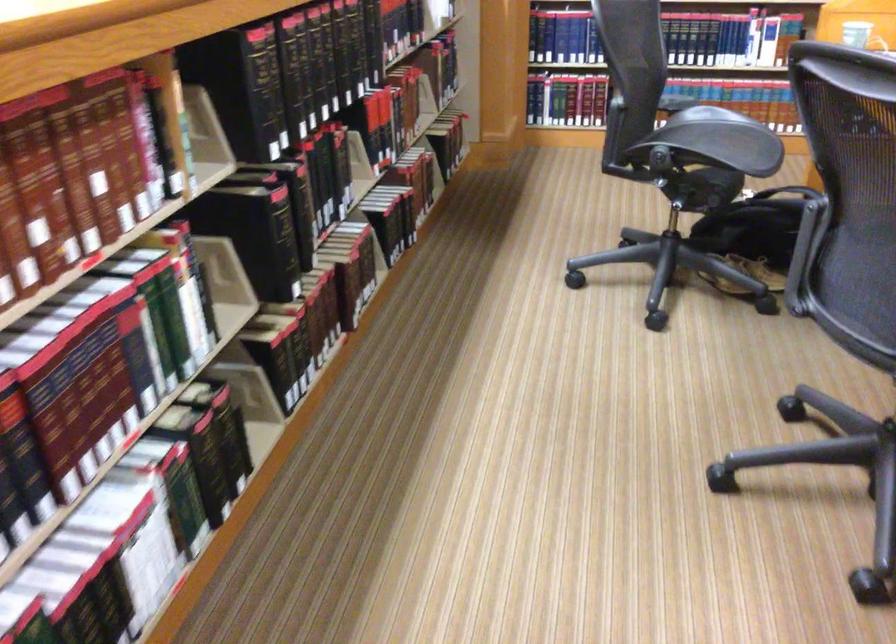
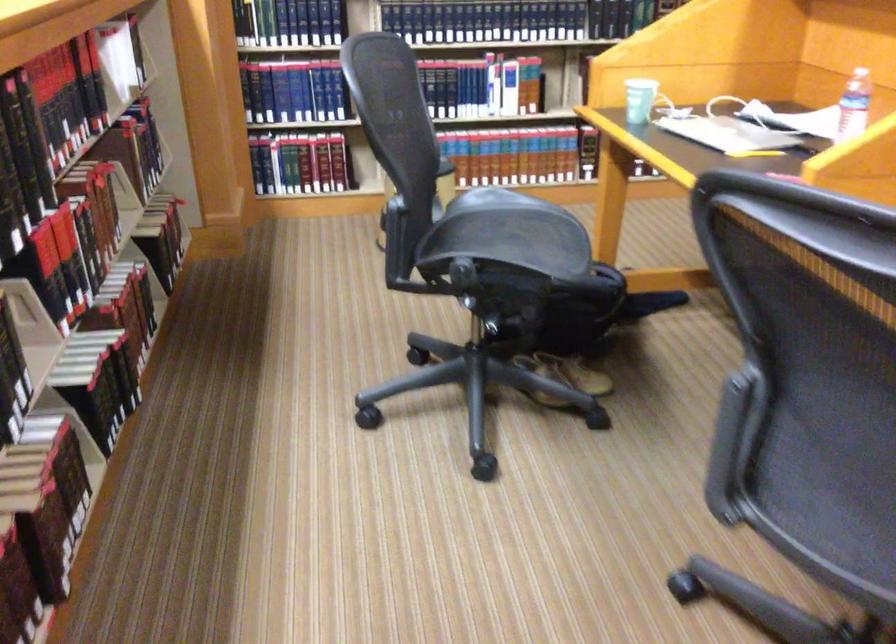
Question: The camera is either moving clockwise (left) or counter-clockwise (right) around the object. The first image is from the beginning of the video and the second image is from the end. Is the camera moving left or right when shooting the video?

Choices:
 (A) Left
 (B) Right

Answer: (A)